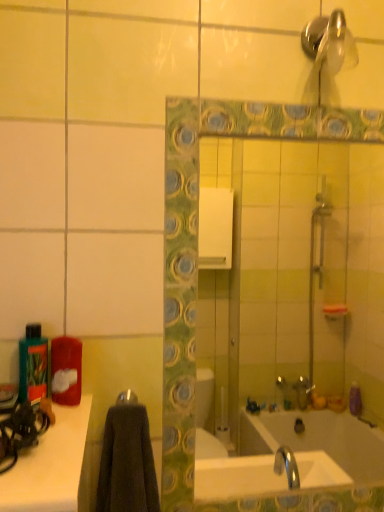
Question: Can you confirm if green matte bottle at left is thinner than green mosaic tile mirror at center?

Choices:
 (A) no
 (B) yes

Answer: (A)

Question: Is green matte bottle at left at the right side of green mosaic tile mirror at center?

Choices:
 (A) yes
 (B) no

Answer: (B)

Question: From the image's perspective, is green matte bottle at left on green mosaic tile mirror at center?

Choices:
 (A) no
 (B) yes

Answer: (A)

Question: Can you confirm if green matte bottle at left is wider than green mosaic tile mirror at center?

Choices:
 (A) no
 (B) yes

Answer: (B)

Question: Can you confirm if green matte bottle at left is taller than green mosaic tile mirror at center?

Choices:
 (A) no
 (B) yes

Answer: (A)

Question: From the image's perspective, is green matte bottle at left under green mosaic tile mirror at center?

Choices:
 (A) yes
 (B) no

Answer: (A)

Question: Can you confirm if green mosaic tile mirror at center is bigger than metallic silver towel bar at center?

Choices:
 (A) yes
 (B) no

Answer: (A)

Question: Is green mosaic tile mirror at center taller than metallic silver towel bar at center?

Choices:
 (A) no
 (B) yes

Answer: (B)

Question: Would you say green mosaic tile mirror at center contains metallic silver towel bar at center?

Choices:
 (A) no
 (B) yes

Answer: (A)

Question: From a real-world perspective, is green mosaic tile mirror at center below metallic silver towel bar at center?

Choices:
 (A) yes
 (B) no

Answer: (B)

Question: Can you confirm if green mosaic tile mirror at center is smaller than metallic silver towel bar at center?

Choices:
 (A) yes
 (B) no

Answer: (B)

Question: Is green mosaic tile mirror at center oriented away from metallic silver towel bar at center?

Choices:
 (A) yes
 (B) no

Answer: (B)

Question: Is metallic silver towel bar at center not close to green matte bottle at left?

Choices:
 (A) yes
 (B) no

Answer: (B)